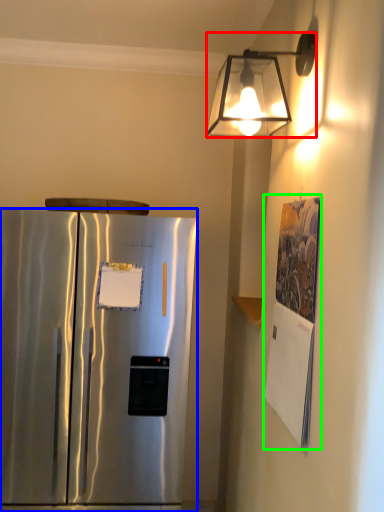
Question: Based on their relative distances, which object is nearer to lamp (highlighted by a red box)? Choose from refrigerator (highlighted by a blue box) and poster (highlighted by a green box).

Choices:
 (A) refrigerator
 (B) poster

Answer: (B)